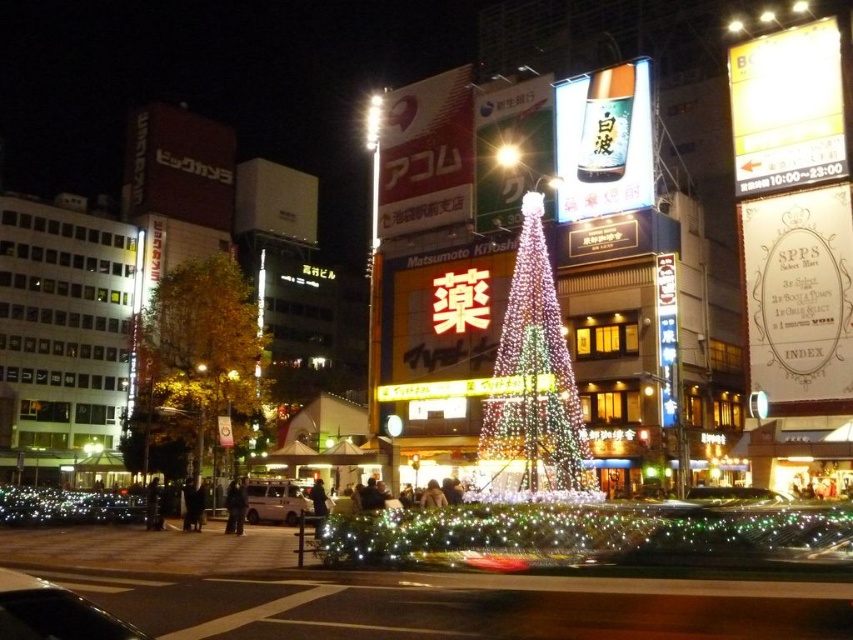
Can you confirm if yellow/golden/leaves at left is positioned above metallic silver car at lower left?

Yes, yellow/golden/leaves at left is above metallic silver car at lower left.

How much distance is there between yellow/golden/leaves at left and metallic silver car at lower left?

16.00 meters

Is point (160, 289) more distant than point (50, 516)?

Yes, point (160, 289) is behind point (50, 516).

Find the location of a particular element. The width and height of the screenshot is (853, 640). yellow/golden/leaves at left is located at coordinates (196, 358).

Does metallic silver car at lower left come in front of shiny silver car at center?

No, it is behind shiny silver car at center.

Does metallic silver car at lower left have a greater height compared to shiny silver car at center?

Correct, metallic silver car at lower left is much taller as shiny silver car at center.

Locate an element on the screen. This screenshot has height=640, width=853. metallic silver car at lower left is located at coordinates (67, 506).

Between point (44, 493) and point (310, 513), which one is positioned in front?

Point (310, 513) is more forward.

Is point (120, 496) closer to camera compared to point (277, 513)?

No, (120, 496) is behind (277, 513).

Who is more forward, (45, 524) or (245, 509)?

Positioned in front is point (245, 509).

This screenshot has height=640, width=853. What are the coordinates of `metallic silver car at lower left` in the screenshot? It's located at (67, 506).